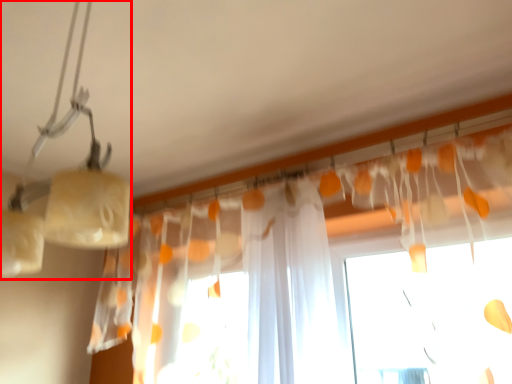
Question: From the image's perspective, considering the relative positions of lamp (annotated by the red box) and curtain in the image provided, where is lamp (annotated by the red box) located with respect to the staircase?

Choices:
 (A) above
 (B) below

Answer: (A)